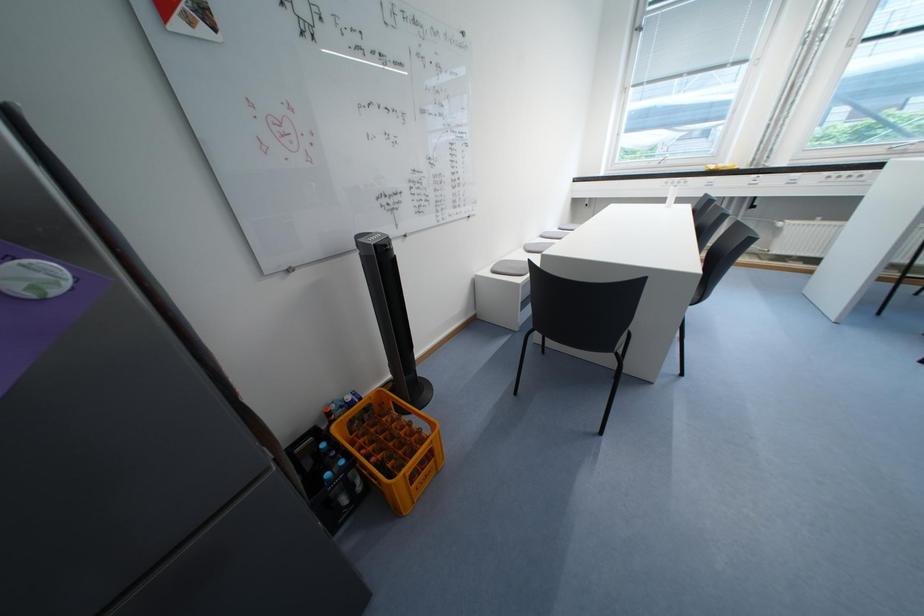
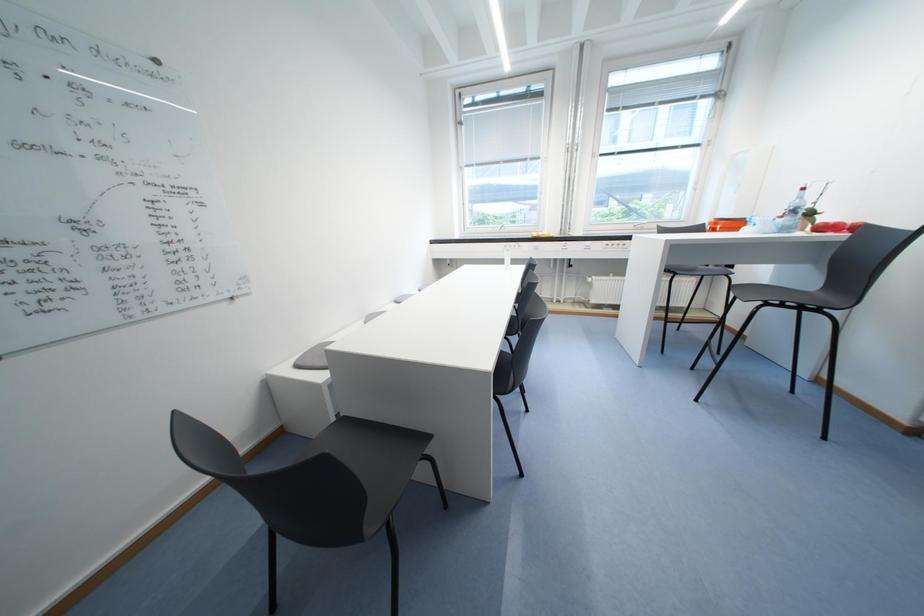
Question: The first image is from the beginning of the video and the second image is from the end. How did the camera likely rotate when shooting the video?

Choices:
 (A) Left
 (B) Right
 (C) Up
 (D) Down

Answer: (B)